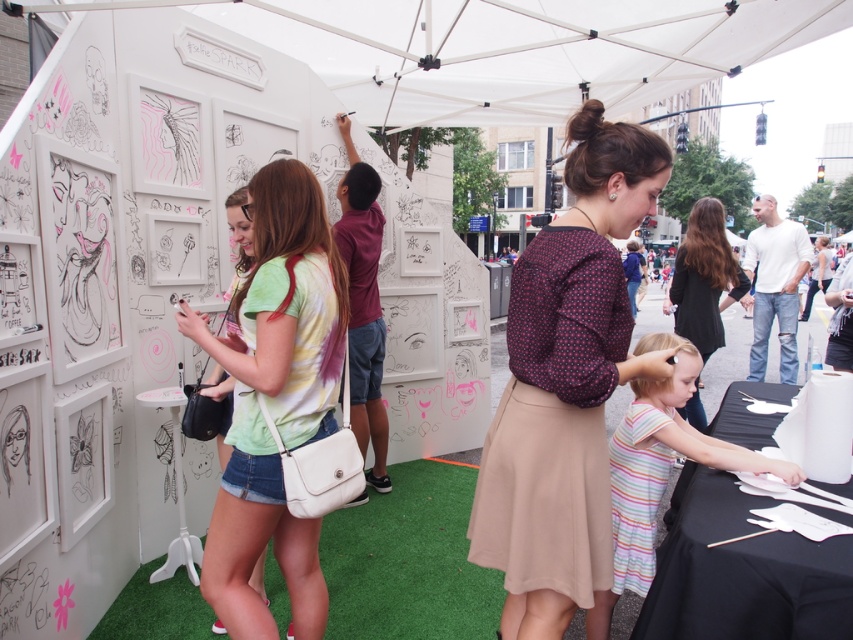
Question: Which point is closer to the camera taking this photo?

Choices:
 (A) (685, 284)
 (B) (236, 296)

Answer: (B)

Question: Among these objects, which one is farthest from the camera?

Choices:
 (A) striped cotton dress at lower center
 (B) matte black blouse at center
 (C) white fabric canopy at upper center

Answer: (C)

Question: Does striped cotton dress at lower center lie in front of matte black blouse at center?

Choices:
 (A) yes
 (B) no

Answer: (A)

Question: Does matte burgundy blouse at center come in front of matte black blouse at center?

Choices:
 (A) yes
 (B) no

Answer: (A)

Question: Is pastel tie-dye t-shirt at center positioned in front of striped cotton dress at lower center?

Choices:
 (A) no
 (B) yes

Answer: (B)

Question: Which object is positioned farthest from the matte black blouse at center?

Choices:
 (A) white fabric canopy at upper center
 (B) matte burgundy blouse at center

Answer: (A)